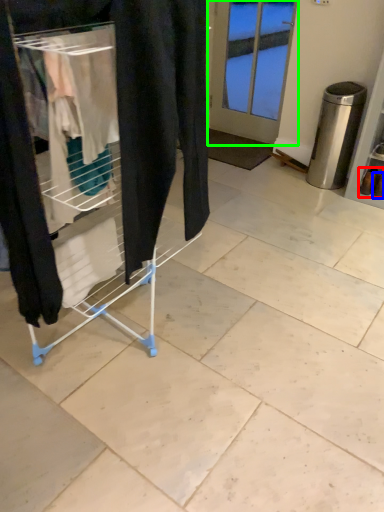
Question: Based on their relative distances, which object is nearer to footwear (highlighted by a red box)? Choose from footwear (highlighted by a blue box) and door (highlighted by a green box).

Choices:
 (A) footwear
 (B) door

Answer: (A)